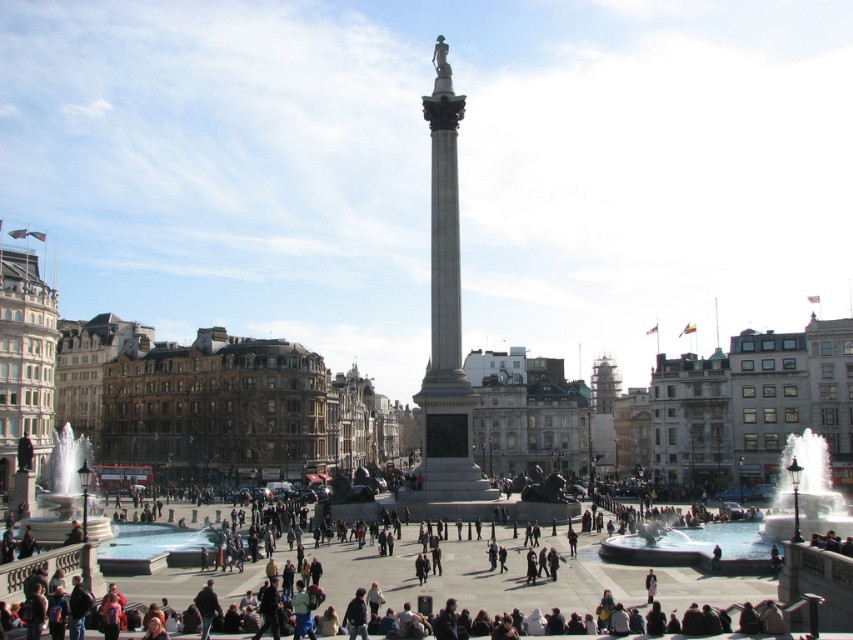
Question: Among these points, which one is nearest to the camera?

Choices:
 (A) (685, 540)
 (B) (451, 284)
 (C) (106, 536)
 (D) (775, 515)

Answer: (C)

Question: Is smooth stone column at center further to camera compared to white marble fountain at lower left?

Choices:
 (A) yes
 (B) no

Answer: (A)

Question: Is shiny metallic fountain at lower right smaller than white marble fountain at lower left?

Choices:
 (A) yes
 (B) no

Answer: (B)

Question: Which point is farther to the camera?

Choices:
 (A) (605, 540)
 (B) (53, 436)

Answer: (B)

Question: Which of the following is the closest to the observer?

Choices:
 (A) (62, 449)
 (B) (428, 483)
 (C) (692, 538)
 (D) (811, 506)

Answer: (D)

Question: Is shiny metallic fountain at lower right thinner than white marble fountain at lower left?

Choices:
 (A) no
 (B) yes

Answer: (A)